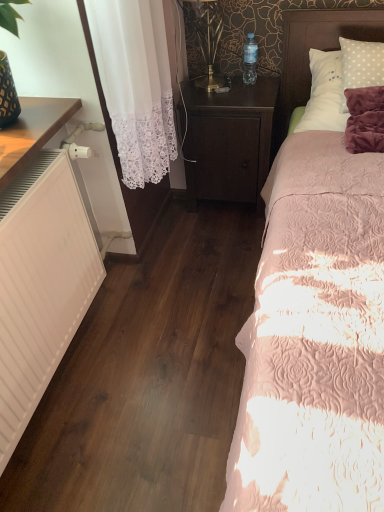
Question: Is dark wood nightstand at center directly adjacent to white polka dot pillow at upper right?

Choices:
 (A) no
 (B) yes

Answer: (A)

Question: Can you confirm if dark wood nightstand at center is smaller than white polka dot pillow at upper right?

Choices:
 (A) yes
 (B) no

Answer: (B)

Question: Considering the relative sizes of dark wood nightstand at center and white polka dot pillow at upper right in the image provided, is dark wood nightstand at center wider than white polka dot pillow at upper right?

Choices:
 (A) no
 (B) yes

Answer: (A)

Question: Is dark wood nightstand at center not within white polka dot pillow at upper right?

Choices:
 (A) no
 (B) yes

Answer: (B)

Question: Is dark wood nightstand at center shorter than white polka dot pillow at upper right?

Choices:
 (A) no
 (B) yes

Answer: (A)

Question: From the image's perspective, is dark wood nightstand at center located beneath white polka dot pillow at upper right?

Choices:
 (A) yes
 (B) no

Answer: (A)

Question: Can you confirm if dark wood nightstand at center is smaller than pink quilted bed at right?

Choices:
 (A) yes
 (B) no

Answer: (A)

Question: Considering the relative sizes of dark wood nightstand at center and pink quilted bed at right in the image provided, is dark wood nightstand at center thinner than pink quilted bed at right?

Choices:
 (A) no
 (B) yes

Answer: (B)

Question: Can you confirm if dark wood nightstand at center is taller than pink quilted bed at right?

Choices:
 (A) yes
 (B) no

Answer: (B)

Question: Is pink quilted bed at right at the back of dark wood nightstand at center?

Choices:
 (A) yes
 (B) no

Answer: (B)

Question: Considering the relative positions of dark wood nightstand at center and pink quilted bed at right in the image provided, is dark wood nightstand at center in front of pink quilted bed at right?

Choices:
 (A) yes
 (B) no

Answer: (B)

Question: From a real-world perspective, is dark wood nightstand at center physically below pink quilted bed at right?

Choices:
 (A) no
 (B) yes

Answer: (B)

Question: From a real-world perspective, is transparent plastic bottle at upper center below white matte heater at left?

Choices:
 (A) no
 (B) yes

Answer: (A)